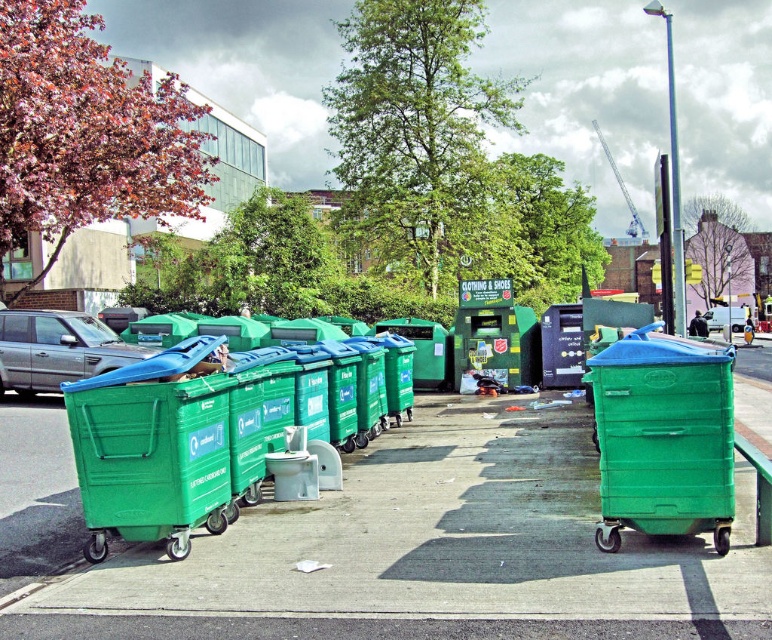
In the scene shown: Between green plastic bin at center and metallic silver car at center, which one has less height?

green plastic bin at center

Can you confirm if green plastic bin at center is positioned above metallic silver car at center?

No.

Find the location of a particular element. This screenshot has height=640, width=772. green plastic bin at center is located at coordinates (168, 442).

Image resolution: width=772 pixels, height=640 pixels. I want to click on green plastic bin at center, so click(x=168, y=442).

Which is below, green plastic pavement at center or green plastic recycling bin at left?

green plastic pavement at center is lower down.

How far apart are green plastic pavement at center and green plastic recycling bin at left?

green plastic pavement at center is 3.64 meters away from green plastic recycling bin at left.

The height and width of the screenshot is (640, 772). Describe the element at coordinates (429, 552) in the screenshot. I see `green plastic pavement at center` at that location.

The width and height of the screenshot is (772, 640). I want to click on green plastic pavement at center, so click(429, 552).

Does green plastic pavement at center appear under metallic silver car at center?

Correct, green plastic pavement at center is located below metallic silver car at center.

Is green plastic pavement at center above metallic silver car at center?

Incorrect, green plastic pavement at center is not positioned above metallic silver car at center.

Measure the distance between point (127, 604) and camera.

They are 5.36 meters apart.

Identify the location of green plastic pavement at center. Image resolution: width=772 pixels, height=640 pixels. (429, 552).